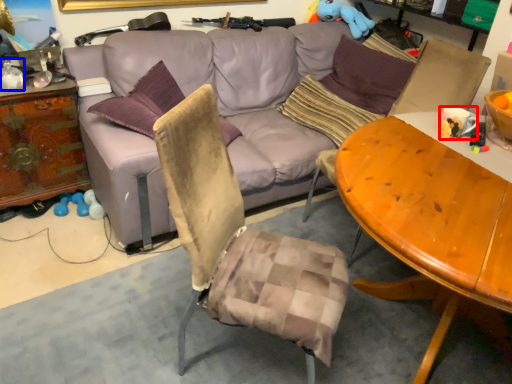
Question: Which of the following is the closest to the observer, coffee cup (highlighted by a red box) or bottle (highlighted by a blue box)?

Choices:
 (A) coffee cup
 (B) bottle

Answer: (A)